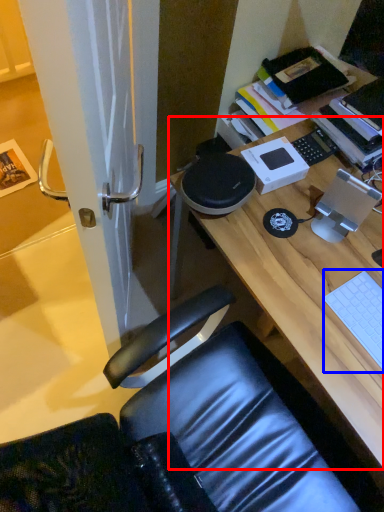
Question: Which object appears closest to the camera in this image, desk (highlighted by a red box) or laptop keyboard (highlighted by a blue box)?

Choices:
 (A) desk
 (B) laptop keyboard

Answer: (A)